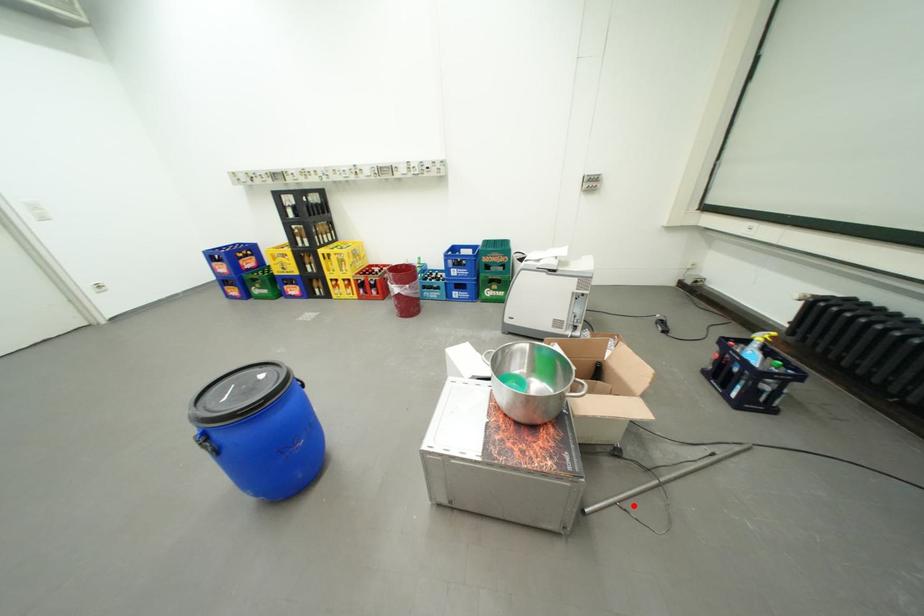
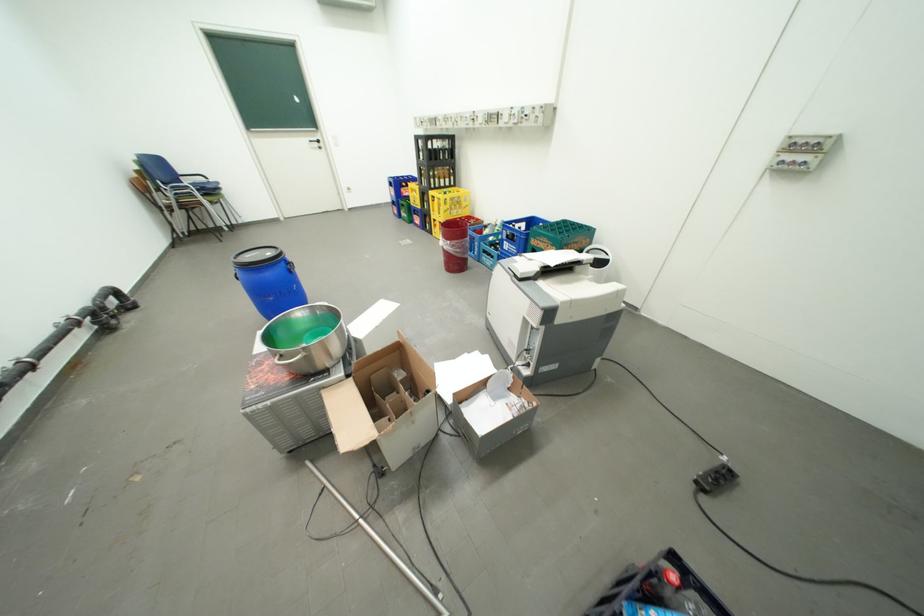
Question: I am providing you with two images of the same scene from different viewpoints. A red point is shown in image1. For the corresponding object point in image2, is it positioned nearer or farther from the camera?

Choices:
 (A) Nearer
 (B) Farther

Answer: (B)